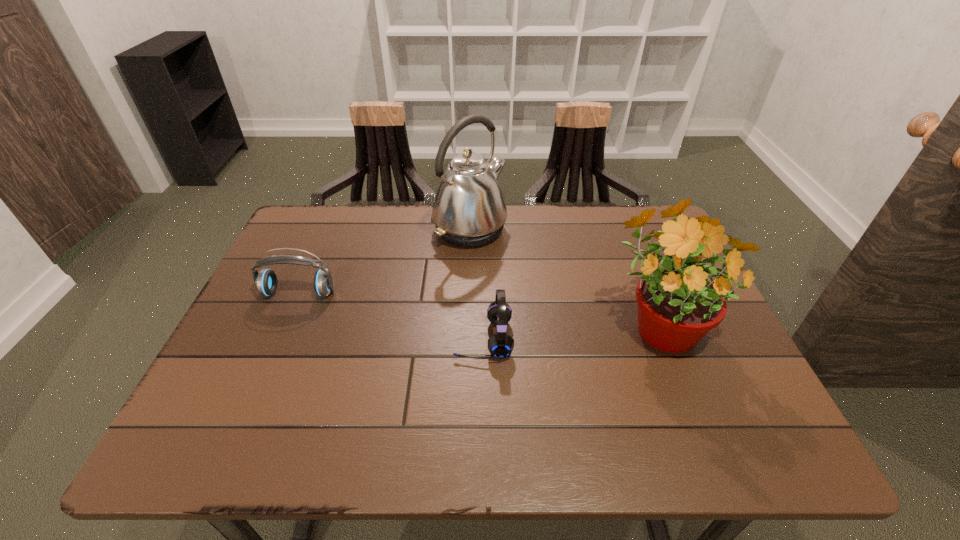
At what (x,y) coordinates should I click in order to perform the action: click on blank area located 0.390m on the ear cushions of the right headset. Please return your answer as a coordinate pair (x, y). The width and height of the screenshot is (960, 540). Looking at the image, I should click on (284, 339).

Image resolution: width=960 pixels, height=540 pixels. In order to click on object positioned at the far edge in this screenshot , I will do `click(469, 210)`.

Identify the location of object present at the left edge. (266, 281).

Locate an element on the screen. This screenshot has height=540, width=960. object at the right edge is located at coordinates [x=678, y=304].

In order to click on vacant space at the far edge of the desktop in this screenshot , I will do `click(352, 225)`.

This screenshot has height=540, width=960. What are the coordinates of `free space at the near edge of the desktop` in the screenshot? It's located at (430, 444).

Identify the location of vacant space at the left edge of the desktop. The image size is (960, 540). (259, 321).

The height and width of the screenshot is (540, 960). In order to click on vacant space at the far left corner of the desktop in this screenshot , I will do `click(322, 227)`.

Locate an element on the screen. The width and height of the screenshot is (960, 540). free area in between the flowerpot and the left headset is located at coordinates (479, 308).

Locate an element on the screen. This screenshot has width=960, height=540. free point between the kettle and the right headset is located at coordinates (x=476, y=284).